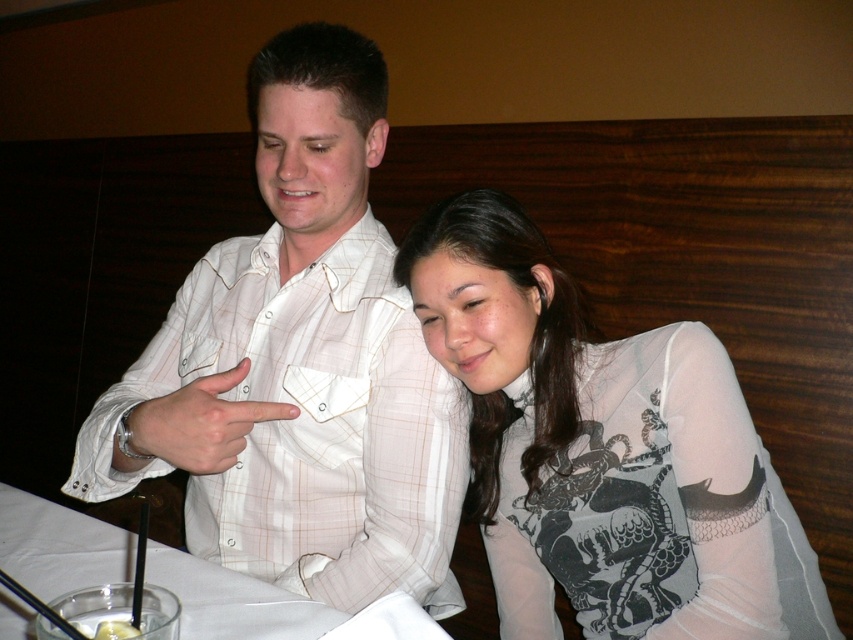
Question: Estimate the real-world distances between objects in this image. Which object is closer to the sheer white blouse at center?

Choices:
 (A) white matte finger at center
 (B) white checkered shirt at center

Answer: (B)

Question: Is white checkered shirt at center below white matte finger at center?

Choices:
 (A) no
 (B) yes

Answer: (A)

Question: Which point is farther to the camera?

Choices:
 (A) (230, 464)
 (B) (631, 406)

Answer: (B)

Question: Which is farther from the sheer white blouse at center?

Choices:
 (A) white checkered shirt at center
 (B) white matte finger at center

Answer: (B)

Question: Is white checkered shirt at center above white matte finger at center?

Choices:
 (A) no
 (B) yes

Answer: (B)

Question: Can you confirm if white checkered shirt at center is smaller than white matte finger at center?

Choices:
 (A) yes
 (B) no

Answer: (B)